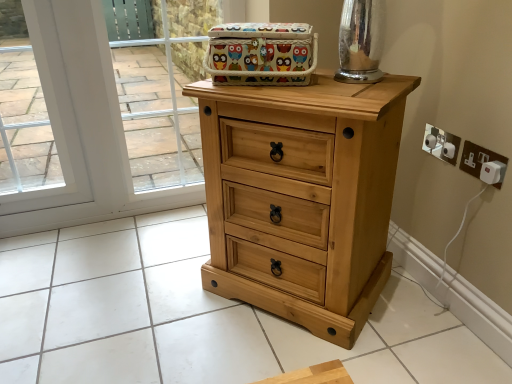
Question: Does point (444, 148) appear closer or farther from the camera than point (472, 163)?

Choices:
 (A) farther
 (B) closer

Answer: (B)

Question: In terms of width, does brushed metal knob at center, which ranks as the first knob in front-to-back order, look wider or thinner when compared to white plastic electrical outlet at right, positioned as the first electric outlet in front-to-back order?

Choices:
 (A) wide
 (B) thin

Answer: (A)

Question: Considering the real-world distances, which object is closest to the brushed metal knob at center, the 2th knob in the back-to-front sequence?

Choices:
 (A) brushed metal knob at upper right, which ranks as the second knob in front-to-back order
 (B) white plastic electric outlet at right, the 2th electric outlet viewed from the front
 (C) owl-patterned fabric basket at upper center
 (D) white plastic electrical outlet at right, positioned as the first electric outlet in front-to-back order
 (E) natural wood chest of drawers at center

Answer: (B)

Question: Estimate the real-world distances between objects in this image. Which object is farther from the transparent glass door at upper left?

Choices:
 (A) natural wood chest of drawers at center
 (B) white plastic electric outlet at right, positioned as the first electric outlet in back-to-front order
 (C) brushed metal knob at center, the 2th knob in the back-to-front sequence
 (D) brushed metal knob at upper right, which ranks as the second knob in front-to-back order
 (E) white plastic electrical outlet at right, positioned as the first electric outlet in front-to-back order

Answer: (E)